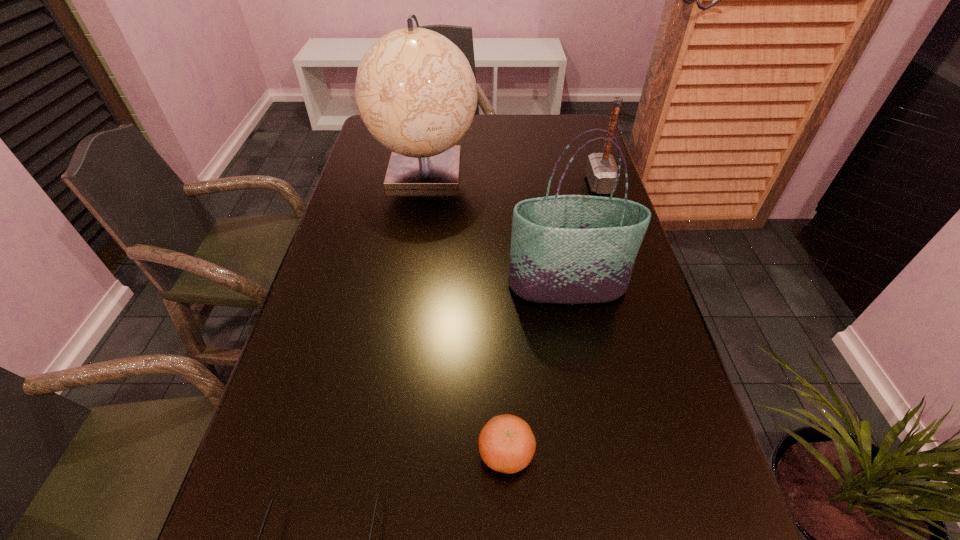
The width and height of the screenshot is (960, 540). I want to click on vacant area between the globe and the hammer, so click(513, 176).

Where is `empty space that is in between the fourth tallest object and the globe`? empty space that is in between the fourth tallest object and the globe is located at coordinates (466, 310).

Identify the location of empty space that is in between the tote bag and the globe. (496, 227).

You are a GUI agent. You are given a task and a screenshot of the screen. Output one action in this format:
    pyautogui.click(x=<x>, y=<y>)
    Task: Click on the free space between the third tallest object and the clementine
    The height and width of the screenshot is (540, 960).
    Given the screenshot: What is the action you would take?
    pyautogui.click(x=553, y=318)

I want to click on object that is the fourth closest to the sunglasses, so click(x=601, y=170).

This screenshot has width=960, height=540. What are the coordinates of `the closest object relative to the third nearest object` in the screenshot? It's located at (415, 91).

The image size is (960, 540). What are the coordinates of `vacant space that satisfies the following two spatial constraints: 1. on the striking surface of the hammer; 2. on the front side of the third farthest object` in the screenshot? It's located at (634, 287).

Identify the location of vacant space that satisfies the following two spatial constraints: 1. on the surface of the globe showing Europe and Africa; 2. on the right side of the fourth farthest object. The width and height of the screenshot is (960, 540). (380, 453).

Identify the location of vacant position in the image that satisfies the following two spatial constraints: 1. on the surface of the third farthest object showing Europe and Africa; 2. on the left side of the globe. (406, 287).

Locate an element on the screen. Image resolution: width=960 pixels, height=540 pixels. vacant space that satisfies the following two spatial constraints: 1. on the surface of the clementine showing Europe and Africa; 2. on the left side of the globe is located at coordinates (380, 453).